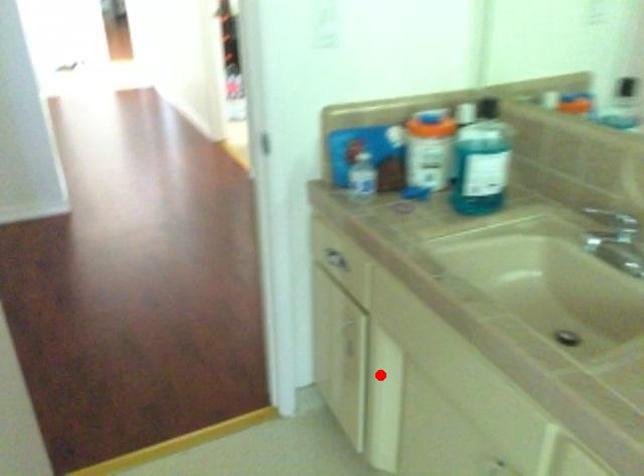
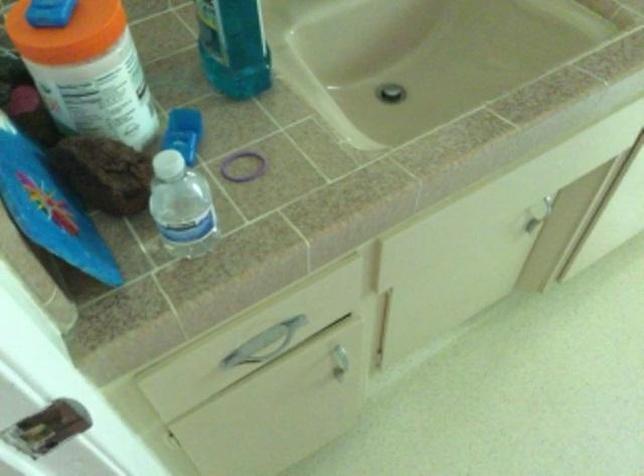
Locate, in the second image, the point that corresponds to the highlighted location in the first image.

(339, 357)